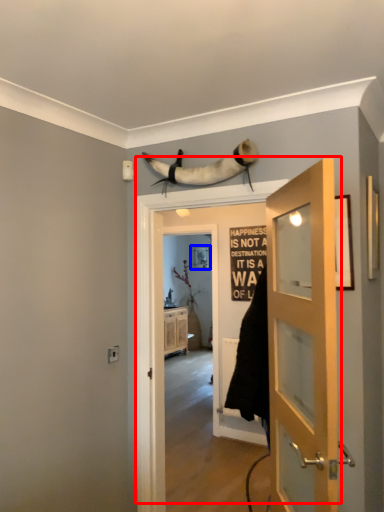
Question: Which of the following is the farthest to the observer, door (highlighted by a red box) or picture frame (highlighted by a blue box)?

Choices:
 (A) door
 (B) picture frame

Answer: (B)